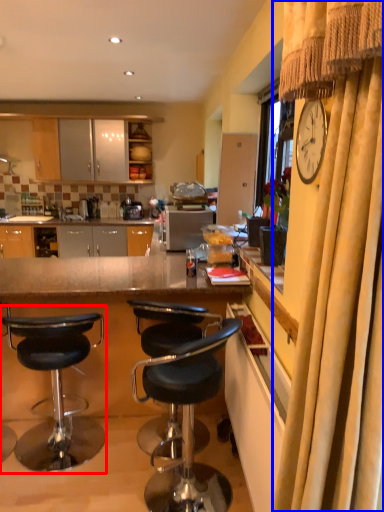
Question: Among these objects, which one is farthest to the camera, chair (highlighted by a red box) or curtain (highlighted by a blue box)?

Choices:
 (A) chair
 (B) curtain

Answer: (A)